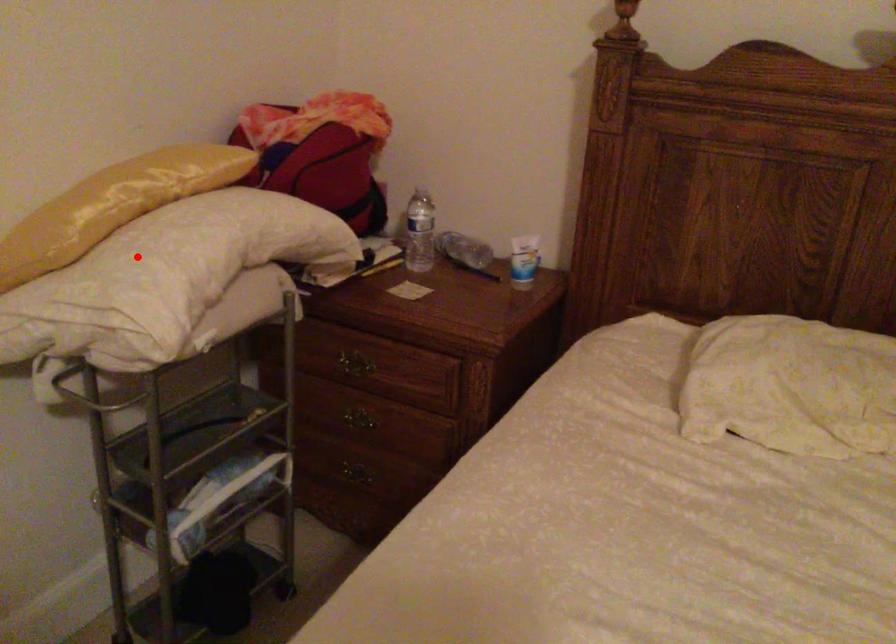
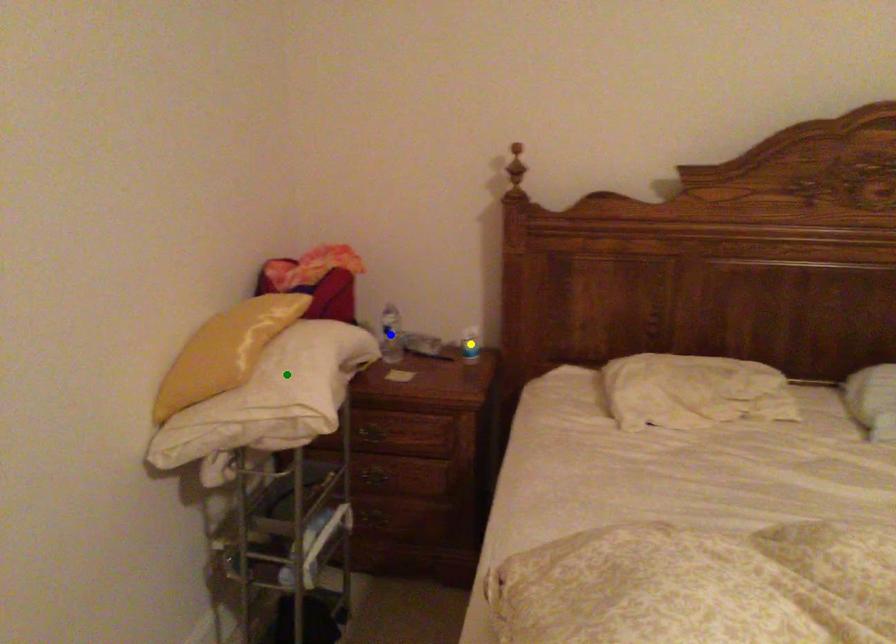
Question: I am providing you with two images of the same scene from different viewpoints. A red point is marked on the first image. You are given multiple points on the second image. Which mark in image 2 goes with the point in image 1?

Choices:
 (A) green point
 (B) blue point
 (C) yellow point

Answer: (A)